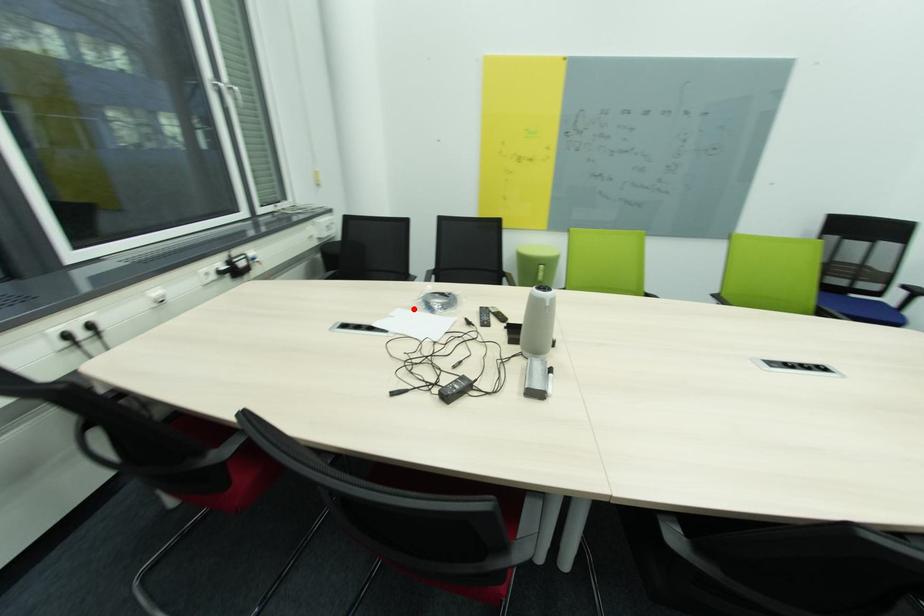
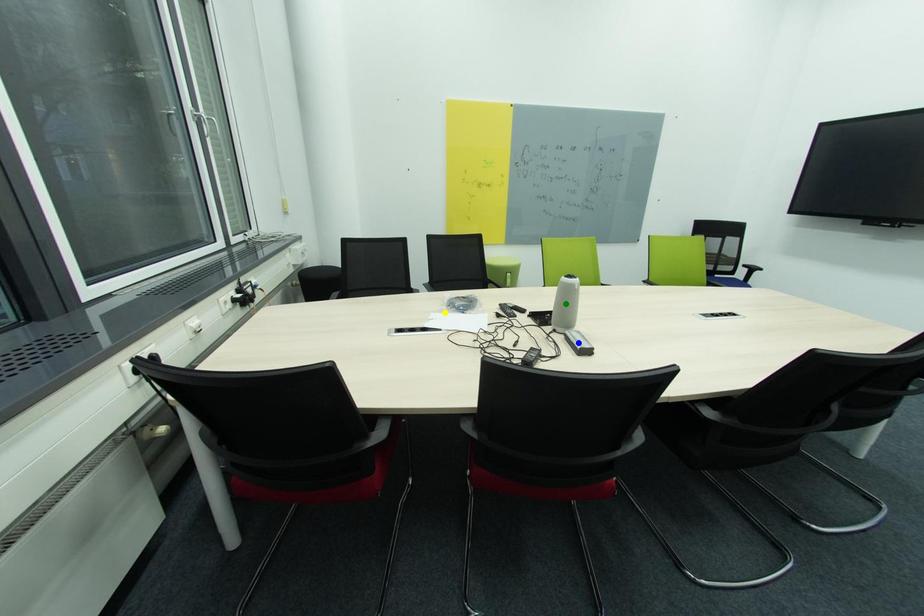
Question: I am providing you with two images of the same scene from different viewpoints. A red point is marked on the first image. You are given multiple points on the second image. Can you choose the point in image 2 that corresponds to the point in image 1?

Choices:
 (A) green point
 (B) blue point
 (C) yellow point

Answer: (C)